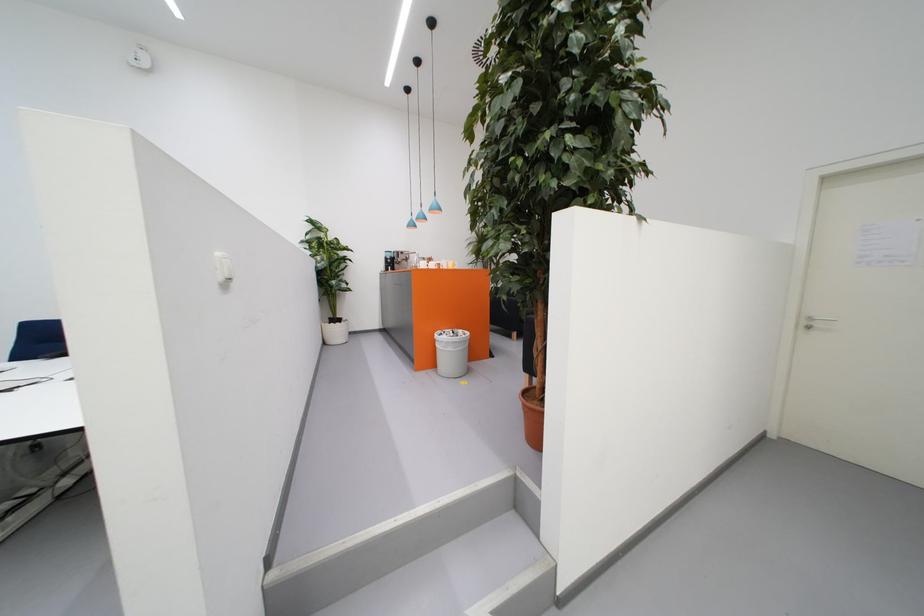
Where is `coffee machine lever`? Image resolution: width=924 pixels, height=616 pixels. coffee machine lever is located at coordinates (388, 261).